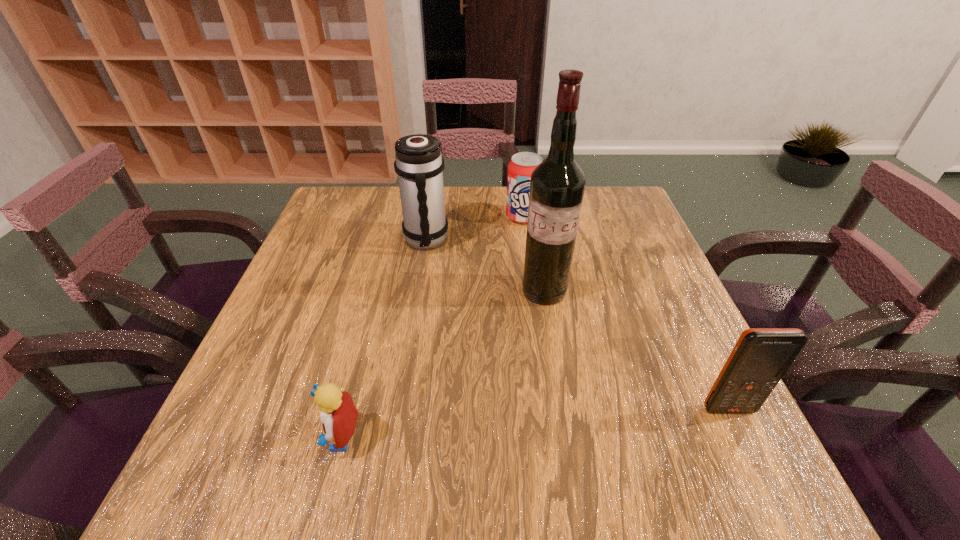
Find the location of a particular element. the nearest object is located at coordinates (338, 414).

You are a GUI agent. You are given a task and a screenshot of the screen. Output one action in this format:
    pyautogui.click(x=<x>, y=<y>)
    Task: Click on the shortest object
    This screenshot has height=540, width=960.
    Given the screenshot: What is the action you would take?
    pyautogui.click(x=338, y=414)

At what (x,y) coordinates should I click in order to perform the action: click on the second nearest object. Please return your answer as a coordinate pair (x, y). Looking at the image, I should click on (761, 356).

I want to click on cellular telephone, so click(x=761, y=356).

Identify the location of soda can. The height and width of the screenshot is (540, 960). (520, 168).

The height and width of the screenshot is (540, 960). Identify the location of thermos bottle. (419, 165).

This screenshot has height=540, width=960. Identify the location of the tallest object. (557, 185).

At what (x,y) coordinates should I click in order to perform the action: click on the third farthest object. Please return your answer as a coordinate pair (x, y). Looking at the image, I should click on (557, 185).

This screenshot has height=540, width=960. Identify the location of vacant space located on the front-facing side of the Lego. (241, 437).

Where is `vacant space located 0.110m on the front-facing side of the Lego`? This screenshot has height=540, width=960. vacant space located 0.110m on the front-facing side of the Lego is located at coordinates (252, 437).